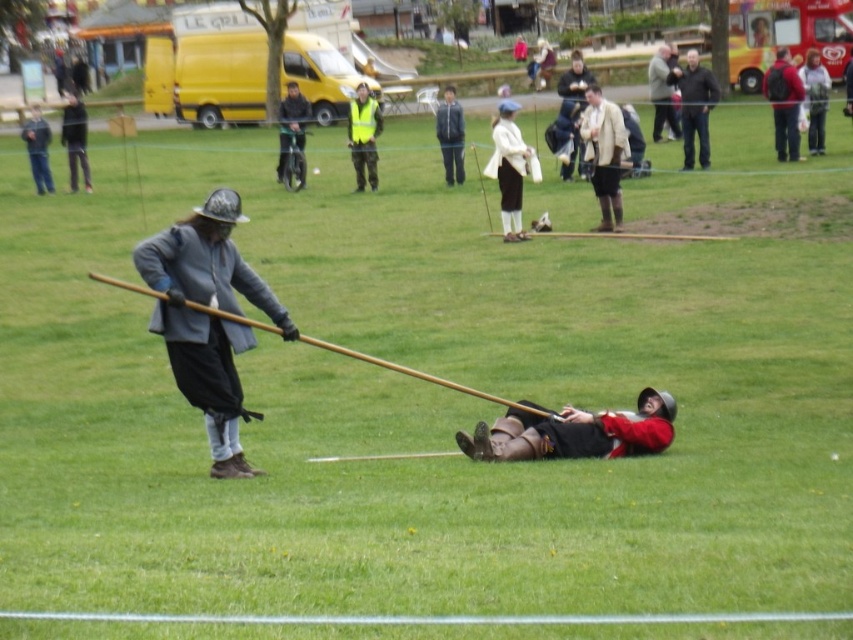
Which is more to the left, white woolen sweater at center or dark blue jacket at upper right?

white woolen sweater at center is more to the left.

Who is positioned more to the right, white woolen sweater at center or dark blue jacket at upper right?

dark blue jacket at upper right

Who is more forward, [488,164] or [793,141]?

Point [488,164] is in front.

I want to click on white woolen sweater at center, so click(508, 168).

Locate an element on the screen. This screenshot has height=640, width=853. dark gray fabric coat at center is located at coordinates (74, 138).

Does brown wood spear at left have a greater width compared to light brown leather jacket at upper right?

Indeed, brown wood spear at left has a greater width compared to light brown leather jacket at upper right.

Can you confirm if brown wood spear at left is positioned above light brown leather jacket at upper right?

No, brown wood spear at left is not above light brown leather jacket at upper right.

Does point (556, 417) lie in front of point (822, 116)?

Yes, it is.

The width and height of the screenshot is (853, 640). I want to click on brown wood spear at left, so click(422, 376).